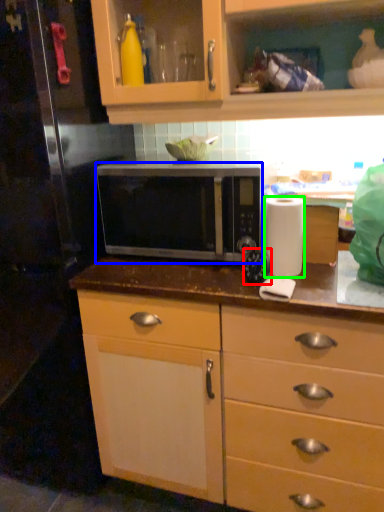
Question: Estimate the real-world distances between objects in this image. Which object is closer to appliance (highlighted by a red box), microwave oven (highlighted by a blue box) or paper towel (highlighted by a green box)?

Choices:
 (A) microwave oven
 (B) paper towel

Answer: (B)